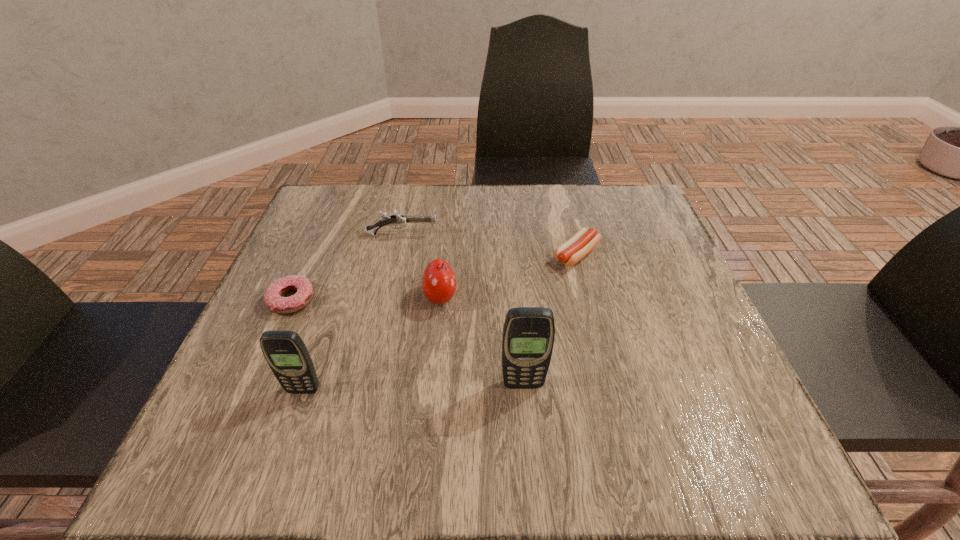
Where is `apple`? Image resolution: width=960 pixels, height=540 pixels. apple is located at coordinates (438, 282).

Where is `free space located 0.050m on the screen of the second object from right to left`? The height and width of the screenshot is (540, 960). free space located 0.050m on the screen of the second object from right to left is located at coordinates (525, 415).

The image size is (960, 540). In order to click on blank space located 0.110m aimed along the barrel of the farthest object in this screenshot , I will do `click(482, 235)`.

At what (x,y) coordinates should I click in order to perform the action: click on vacant region located 0.200m on the back of the sausage. Please return your answer as a coordinate pair (x, y). Looking at the image, I should click on (562, 194).

Identify the location of vacant space located on the right of the doughnut. This screenshot has height=540, width=960. coord(411,300).

Identify the location of vacant region located on the front of the third tallest object. The image size is (960, 540). (432, 392).

Identify the location of object that is at the far edge. This screenshot has width=960, height=540. (398, 219).

Identify the location of cellular telephone that is at the left edge. The height and width of the screenshot is (540, 960). (285, 352).

The image size is (960, 540). I want to click on doughnut that is at the left edge, so click(x=273, y=298).

Locate an element on the screen. object that is at the near left corner is located at coordinates (285, 352).